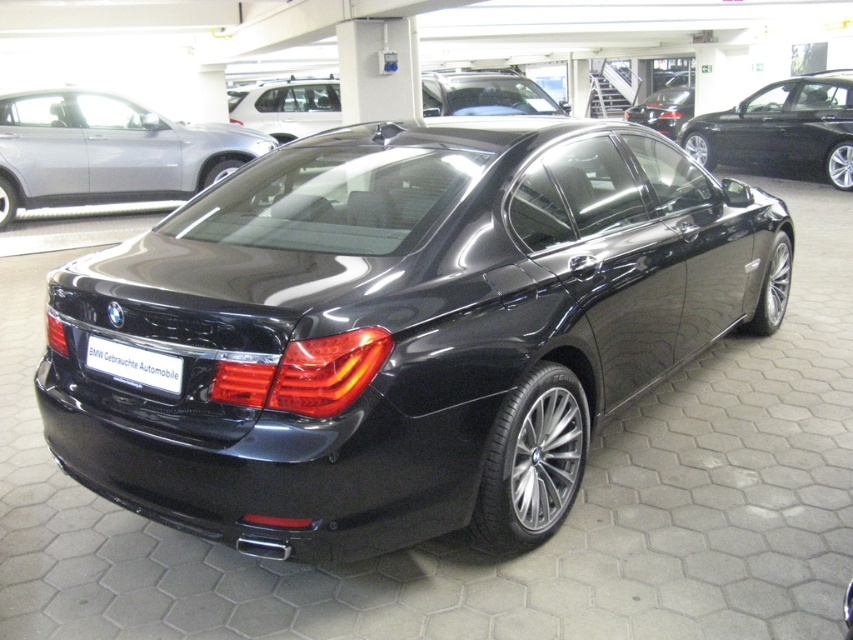
Question: Considering the relative positions of glossy black sedan at upper left and glossy black sedan at center in the image provided, where is glossy black sedan at upper left located with respect to glossy black sedan at center?

Choices:
 (A) below
 (B) above

Answer: (A)

Question: Which point appears farthest from the camera in this image?

Choices:
 (A) (834, 97)
 (B) (111, 108)

Answer: (A)

Question: Among these points, which one is nearest to the camera?

Choices:
 (A) (677, 125)
 (B) (677, 138)
 (C) (612, 257)
 (D) (111, 372)

Answer: (D)

Question: Which point is closer to the camera taking this photo?

Choices:
 (A) (688, 99)
 (B) (47, 324)

Answer: (B)

Question: Does black plastic license plate at rear appear over glossy black sedan at center?

Choices:
 (A) yes
 (B) no

Answer: (B)

Question: Does glossy black sedan at upper left appear under black plastic license plate at rear?

Choices:
 (A) no
 (B) yes

Answer: (A)